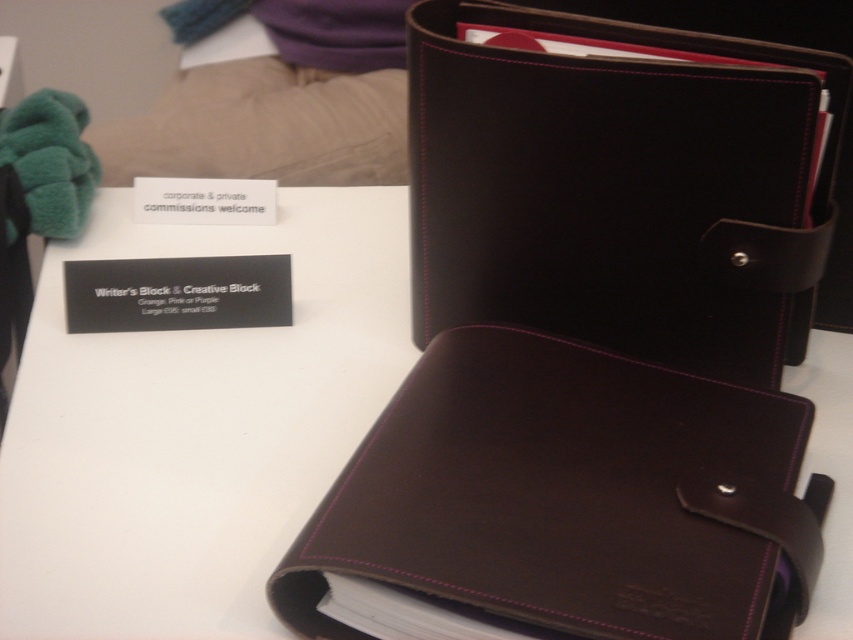
Question: Can you confirm if dark brown leather binder at center is positioned to the right of brown leather folder at center?

Choices:
 (A) yes
 (B) no

Answer: (A)

Question: Observing the image, what is the correct spatial positioning of brown leather wallet at center in reference to dark brown leather binder at center?

Choices:
 (A) above
 (B) below

Answer: (B)

Question: Which of the following is the farthest from the observer?

Choices:
 (A) (45, 467)
 (B) (627, 483)

Answer: (A)

Question: Which point is farther to the camera?

Choices:
 (A) dark brown leather binder at center
 (B) brown leather wallet at center

Answer: (A)

Question: Is brown leather wallet at center positioned in front of dark brown leather binder at center?

Choices:
 (A) no
 (B) yes

Answer: (B)

Question: Estimate the real-world distances between objects in this image. Which object is closer to the brown leather folder at center?

Choices:
 (A) brown leather wallet at center
 (B) dark brown leather binder at center

Answer: (B)